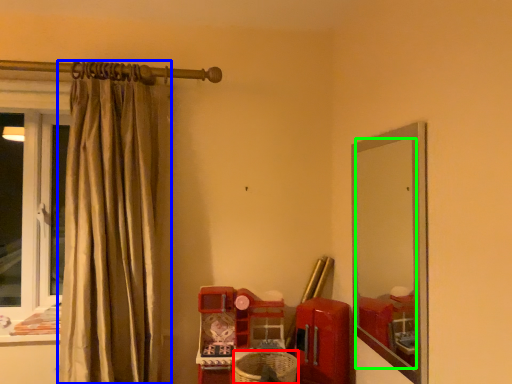
Question: Estimate the real-world distances between objects in this image. Which object is closer to basket (highlighted by a red box), curtain (highlighted by a blue box) or mirror (highlighted by a green box)?

Choices:
 (A) curtain
 (B) mirror

Answer: (B)